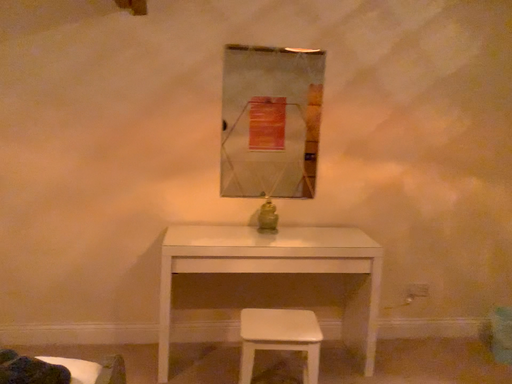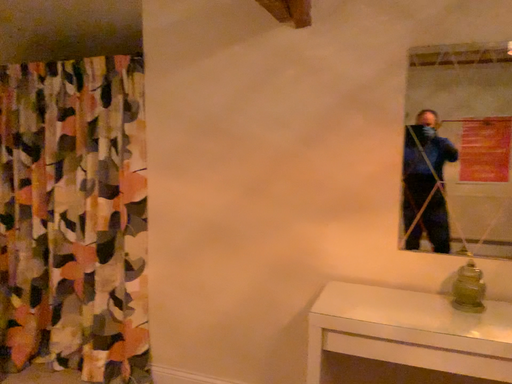
Question: How did the camera likely rotate when shooting the video?

Choices:
 (A) rotated left
 (B) rotated right

Answer: (A)